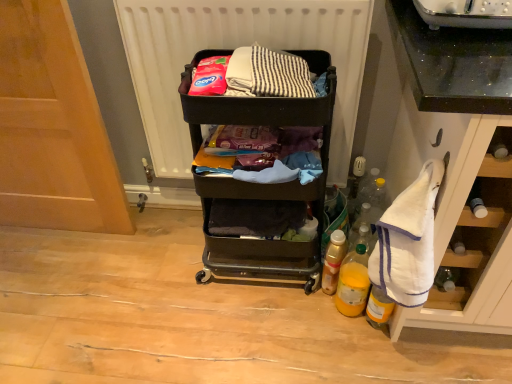
Identify the location of free point below white terry cloth towel at right (from a real-world perspective). (385, 345).